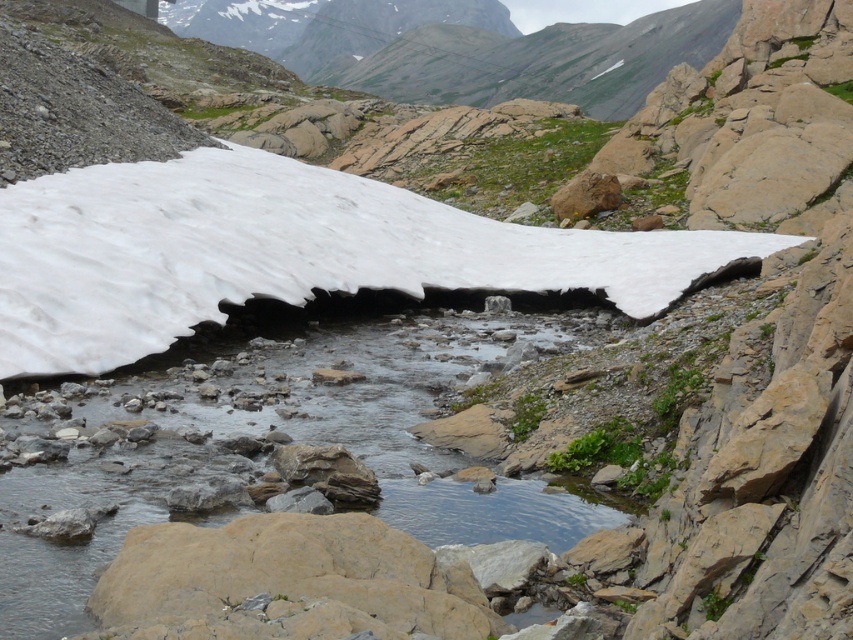
Which is more to the right, white matte snow at upper center or clear water at center?

white matte snow at upper center

Is white matte snow at upper center positioned before clear water at center?

No.

Locate an element on the screen. white matte snow at upper center is located at coordinates (283, 252).